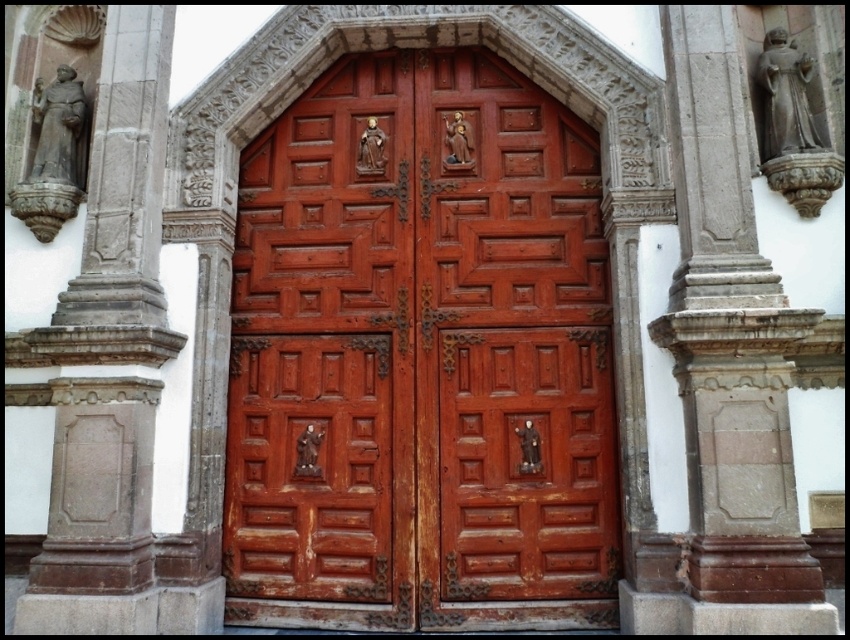
You are an architect visiting a historical site and need to determine the spatial relationship between the rustic wood door at center and the gray stone statue at left. Which object occupies more space in the image?

The rustic wood door at center is larger in size than the gray stone statue at left, so it occupies more space in the image.

You are standing in front of the doors and want to touch both the rustic wood door at center and the gray stone statue at left. Which object should you reach for first?

You should reach for the rustic wood door at center first because it is closer to you than the gray stone statue at left, which is further away.

You are an architect assessing the proportions of the building. Given the rustic wood door at center and the gray stone statue at left, which one is shorter?

The rustic wood door at center is shorter than the gray stone statue at left.